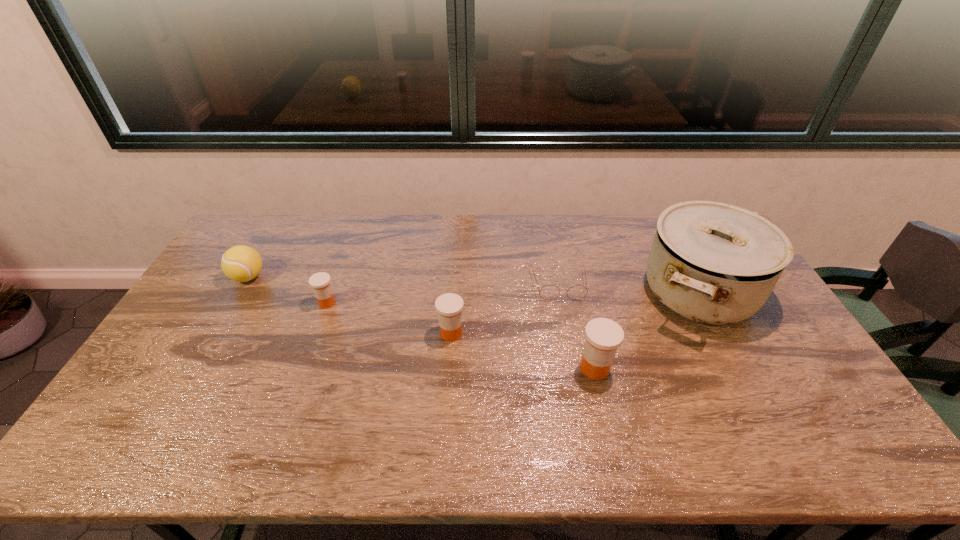
This screenshot has height=540, width=960. I want to click on free space located 0.130m on the label of the leftmost medicine, so click(276, 302).

What are the coordinates of `vacant space positioned on the label of the leftmost medicine` in the screenshot? It's located at (209, 302).

Image resolution: width=960 pixels, height=540 pixels. What are the coordinates of `free space located on the label of the leftmost medicine` in the screenshot? It's located at click(x=205, y=302).

The width and height of the screenshot is (960, 540). Find the location of `free space located 0.070m on the label of the second medicine from left to right`. free space located 0.070m on the label of the second medicine from left to right is located at coordinates (414, 333).

The width and height of the screenshot is (960, 540). What are the coordinates of `free space located on the label of the second medicine from left to right` in the screenshot? It's located at (394, 333).

At what (x,y) coordinates should I click in order to perform the action: click on vacant space located on the label of the second medicine from left to right. Please return your answer as a coordinate pair (x, y). Looking at the image, I should click on (376, 333).

You are a GUI agent. You are given a task and a screenshot of the screen. Output one action in this format:
    pyautogui.click(x=<x>, y=<y>)
    Task: Click on the vacant space located 0.080m on the label of the rightmost medicine
    This screenshot has width=960, height=540.
    Given the screenshot: What is the action you would take?
    pyautogui.click(x=605, y=410)

The height and width of the screenshot is (540, 960). In order to click on vacant space located 0.180m on the front of the rightmost object in this screenshot , I will do `click(755, 399)`.

Where is `free space located 0.310m on the back of the leftmost object`? This screenshot has height=540, width=960. free space located 0.310m on the back of the leftmost object is located at coordinates (284, 215).

Image resolution: width=960 pixels, height=540 pixels. Find the location of `vacant area located 0.090m on the temples of the shortest object`. vacant area located 0.090m on the temples of the shortest object is located at coordinates (566, 323).